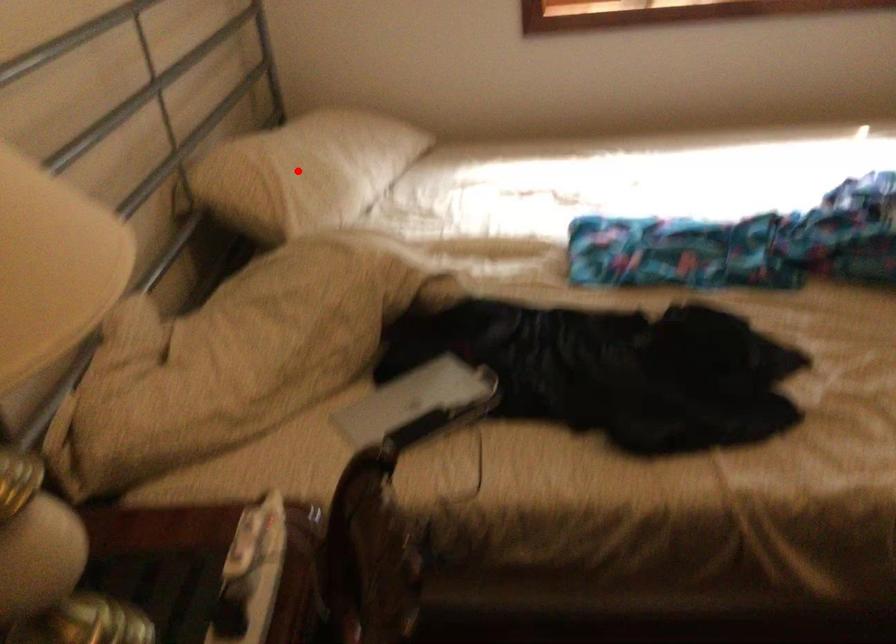
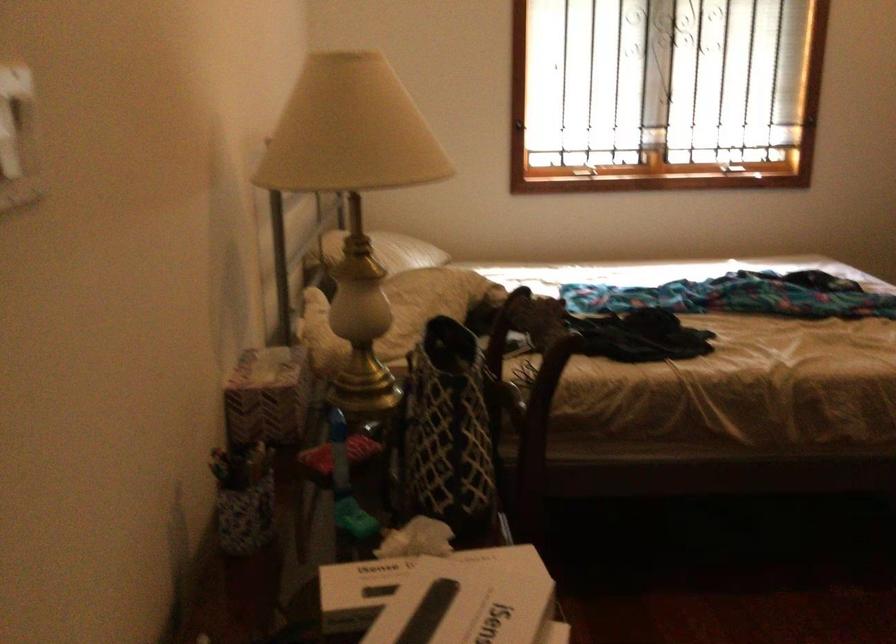
Question: I am providing you with two images of the same scene from different viewpoints. A red point is shown in image1. For the corresponding object point in image2, is it positioned nearer or farther from the camera?

Choices:
 (A) Nearer
 (B) Farther

Answer: (B)